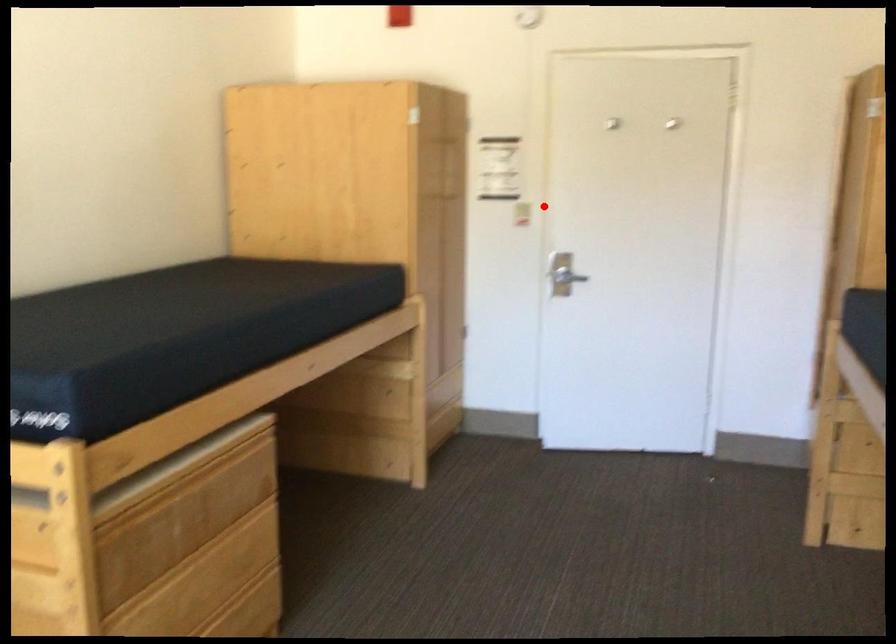
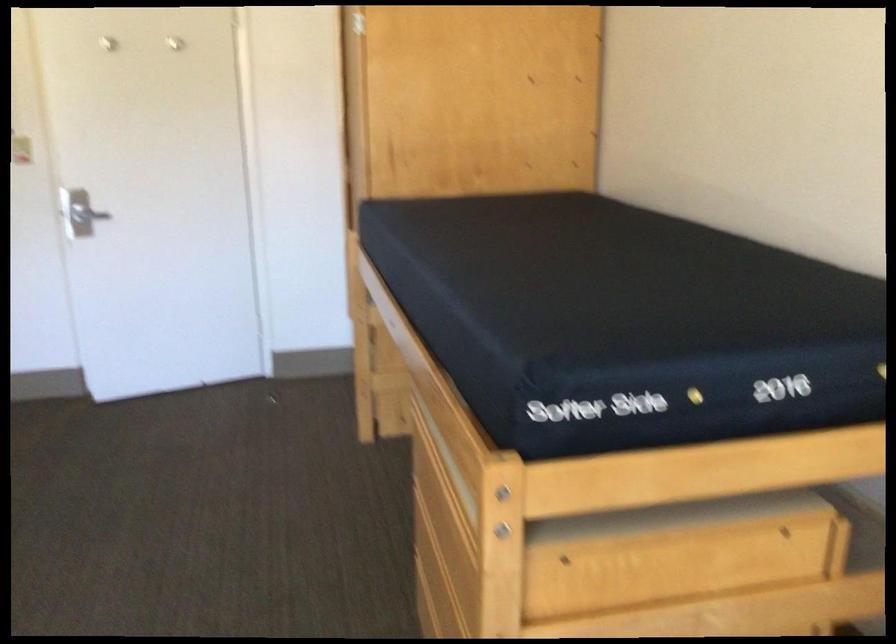
Locate, in the second image, the point that corresponds to the highlighted location in the first image.

(21, 149)